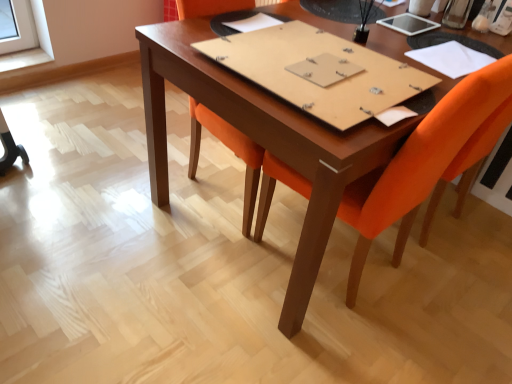
At what (x,y) coordinates should I click in order to perform the action: click on vacant space to the right of orange fabric chair at center. Please return your answer as a coordinate pair (x, y). The width and height of the screenshot is (512, 384). Looking at the image, I should click on (465, 297).